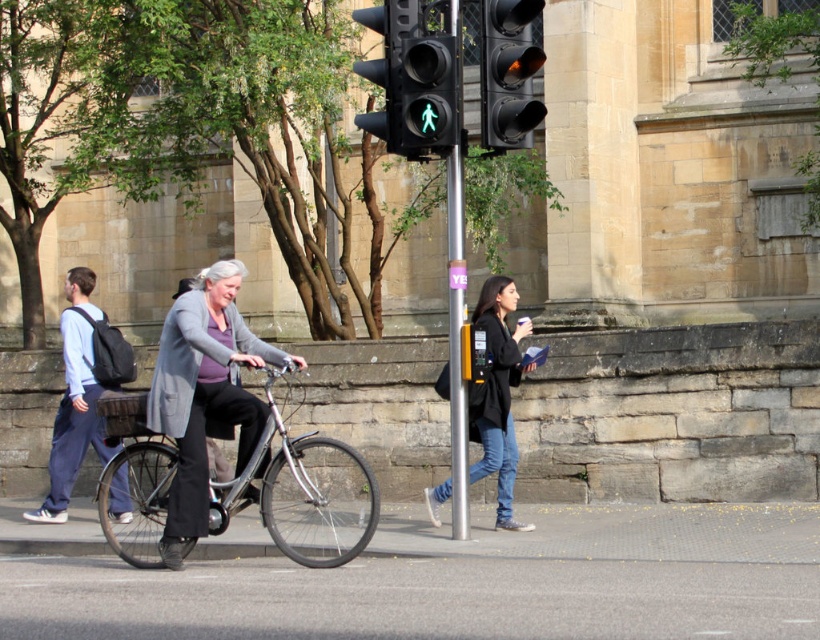
Question: Which object is farther from the camera taking this photo?

Choices:
 (A) matte blue shirt at left
 (B) silver metallic pole at center
 (C) black leather jacket at center
 (D) silver metallic bicycle at center

Answer: (A)

Question: Which of these objects is positioned farthest from the amber glass traffic light at center?

Choices:
 (A) silver metallic bicycle at center
 (B) green matte pedestrian signal at center

Answer: (A)

Question: Is green matte pedestrian signal at center positioned behind black leather jacket at center?

Choices:
 (A) yes
 (B) no

Answer: (B)

Question: Is green matte pedestrian signal at center positioned before amber glass traffic light at center?

Choices:
 (A) yes
 (B) no

Answer: (B)

Question: Which of the following is the farthest from the observer?

Choices:
 (A) (172, 490)
 (B) (270, 381)
 (C) (520, 124)
 (D) (443, 67)

Answer: (B)

Question: Can you confirm if silver metallic bicycle at center is positioned to the left of silver metallic pole at center?

Choices:
 (A) yes
 (B) no

Answer: (A)